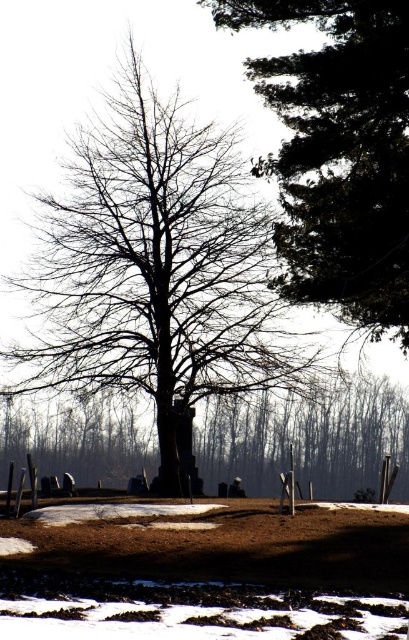
Question: Which of the following is the farthest from the observer?

Choices:
 (A) dark green textured tree at upper right
 (B) bare wood tree at center

Answer: (B)

Question: Where is bare wood tree at center located in relation to dark green textured tree at upper right in the image?

Choices:
 (A) left
 (B) right

Answer: (A)

Question: Estimate the real-world distances between objects in this image. Which object is farther from the bare wood tree at center?

Choices:
 (A) dark green textured tree at upper right
 (B) smooth brown tree trunk at center

Answer: (A)

Question: Does bare wood tree at center appear over smooth brown tree trunk at center?

Choices:
 (A) yes
 (B) no

Answer: (A)

Question: Can you confirm if bare wood tree at center is positioned below dark green textured tree at upper right?

Choices:
 (A) yes
 (B) no

Answer: (A)

Question: Which point is farther to the camera?

Choices:
 (A) bare wood tree at center
 (B) dark green textured tree at upper right

Answer: (A)